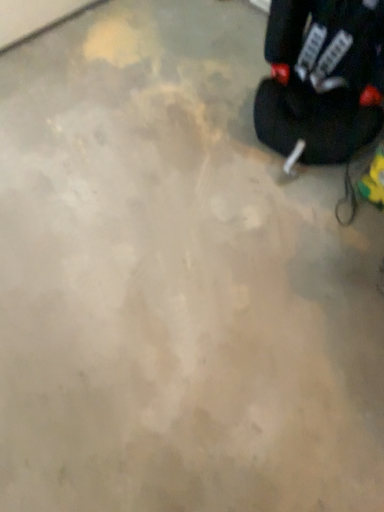
Measure the distance between point (355, 82) and camera.

A distance of 5.12 feet exists between point (355, 82) and camera.

This screenshot has width=384, height=512. What do you see at coordinates (322, 78) in the screenshot?
I see `black fabric backpack at upper right` at bounding box center [322, 78].

Identify the location of black fabric backpack at upper right. (322, 78).

This screenshot has width=384, height=512. Find the location of `black fabric backpack at upper right`. black fabric backpack at upper right is located at coordinates (322, 78).